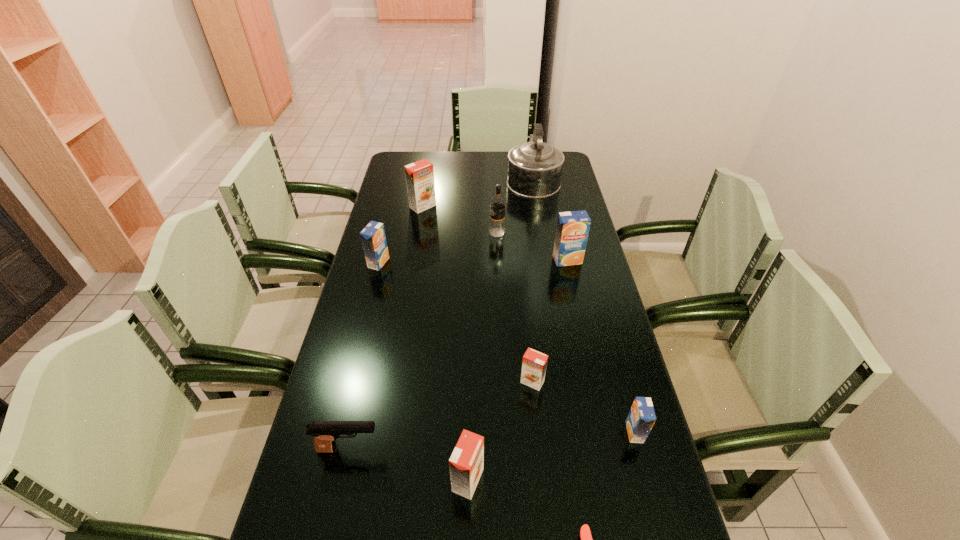
Where is `pistol that is at the left edge`? The height and width of the screenshot is (540, 960). pistol that is at the left edge is located at coordinates (325, 433).

Image resolution: width=960 pixels, height=540 pixels. Find the location of `kettle located in the right edge section of the desktop`. kettle located in the right edge section of the desktop is located at coordinates (535, 168).

I want to click on object present at the far right corner, so click(x=535, y=168).

This screenshot has height=540, width=960. In the image, there is a desktop. What are the coordinates of `vacant space at the far edge` in the screenshot? It's located at (508, 163).

This screenshot has width=960, height=540. Find the location of `free space at the left edge of the desktop`. free space at the left edge of the desktop is located at coordinates (404, 200).

Where is `vacant space at the right edge of the desktop`? This screenshot has height=540, width=960. vacant space at the right edge of the desktop is located at coordinates (574, 373).

The width and height of the screenshot is (960, 540). Find the location of `free spot between the tallest object and the pistol`. free spot between the tallest object and the pistol is located at coordinates (441, 314).

At what (x,y) coordinates should I click in order to perform the action: click on free space between the second biggest blue orange_juice and the fifth object from left to right. Please return your answer as a coordinate pair (x, y). Image resolution: width=960 pixels, height=540 pixels. Looking at the image, I should click on (438, 247).

This screenshot has height=540, width=960. Identify the location of vacant point located between the farthest orange orange juice and the second biggest blue orange_juice. (400, 234).

The image size is (960, 540). I want to click on free space between the second biggest blue orange_juice and the rightmost orange_juice, so click(507, 347).